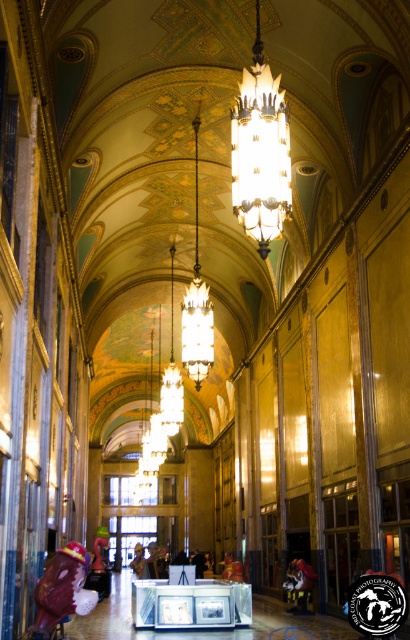
You are standing in the grand hallway and want to take a photo of the matte glass chandelier at center with your camera. Considering the distance between you and the chandelier, can you capture the entire chandelier in one shot without moving closer?

The matte glass chandelier at center and camera are 31.17 meters apart. At this distance, it is possible to capture the entire chandelier in one shot without moving closer, provided the camera has a wide enough lens or zoom capability to encompass the chandelier at 31.17 meters.

You are an interior designer planning to install a new lighting fixture in the hallway. You have two options from the image provided. The first is the matte glass chandelier at center, and the second is the gold metallic chandelier at center. Based on their sizes, which one would you choose if you want a wider fixture to dominate the space?

The gold metallic chandelier at center is wider than the matte glass chandelier at center, so it would be the better choice to dominate the space with its wider size.